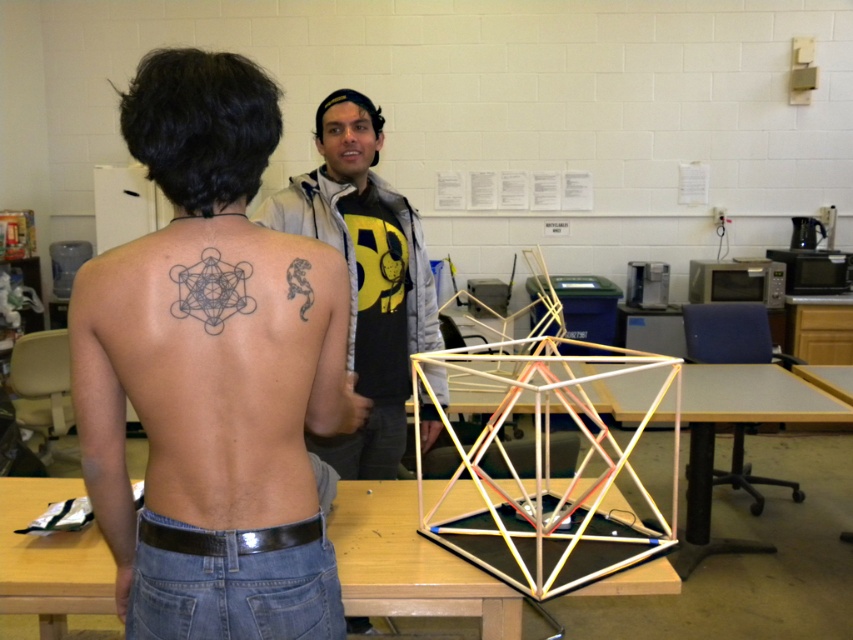
You are an artist observing a person in the scene. The person has two tattoos on their back. Which tattoo is located lower on their body, the black ink tattoo at upper center or the black ink lizard at upper back?

The black ink tattoo at upper center is positioned under the black ink lizard at upper back, meaning it is lower on the body.

You are an artist observing the scene and want to sketch the black ink tattoo at upper center and the matte gray hoodie at center. Which object should you draw first if you want to capture the one that is closer to the viewer?

The black ink tattoo at upper center is closer to the viewer than the matte gray hoodie at center because it is not as tall, so you should draw it first.

You are an observer looking at the scene. You notice the black ink tattoo at upper center and the matte gray hoodie at center. Which object is located to the left of the other?

The black ink tattoo at upper center is positioned on the left side of matte gray hoodie at center.